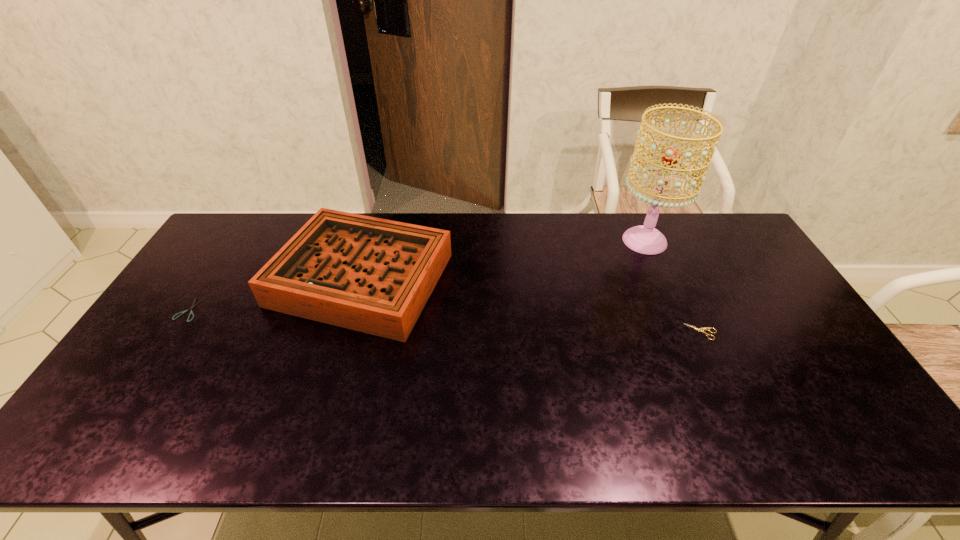
In order to click on free space between the right shears and the leftmost object in this screenshot , I will do `click(445, 321)`.

This screenshot has height=540, width=960. I want to click on empty space that is in between the leftmost object and the right shears, so click(445, 321).

This screenshot has width=960, height=540. What are the coordinates of `free space between the right shears and the left shears` in the screenshot? It's located at (445, 321).

Locate an element on the screen. The width and height of the screenshot is (960, 540). vacant point located between the left shears and the right shears is located at coordinates (445, 321).

I want to click on vacant area between the third object from right to left and the lampshade, so click(x=503, y=259).

Locate an element on the screen. This screenshot has width=960, height=540. free area in between the second tallest object and the tallest object is located at coordinates point(503,259).

You are a GUI agent. You are given a task and a screenshot of the screen. Output one action in this format:
    pyautogui.click(x=<x>, y=<y>)
    Task: Click on the free space between the lampshade and the second object from left to right
    This screenshot has height=540, width=960.
    Given the screenshot: What is the action you would take?
    pyautogui.click(x=503, y=259)

Where is `object that is the second closest to the taller shears`? object that is the second closest to the taller shears is located at coordinates (372, 275).

Locate which object ranks third in proximity to the tallest object. Please provide its 2D coordinates. Your answer should be formatted as a tuple, i.e. [(x, y)], where the tuple contains the x and y coordinates of a point satisfying the conditions above.

[(191, 312)]

Image resolution: width=960 pixels, height=540 pixels. Identify the location of free spot that satisfies the following two spatial constraints: 1. on the back side of the farther shears; 2. on the right side of the tallest object. (234, 241).